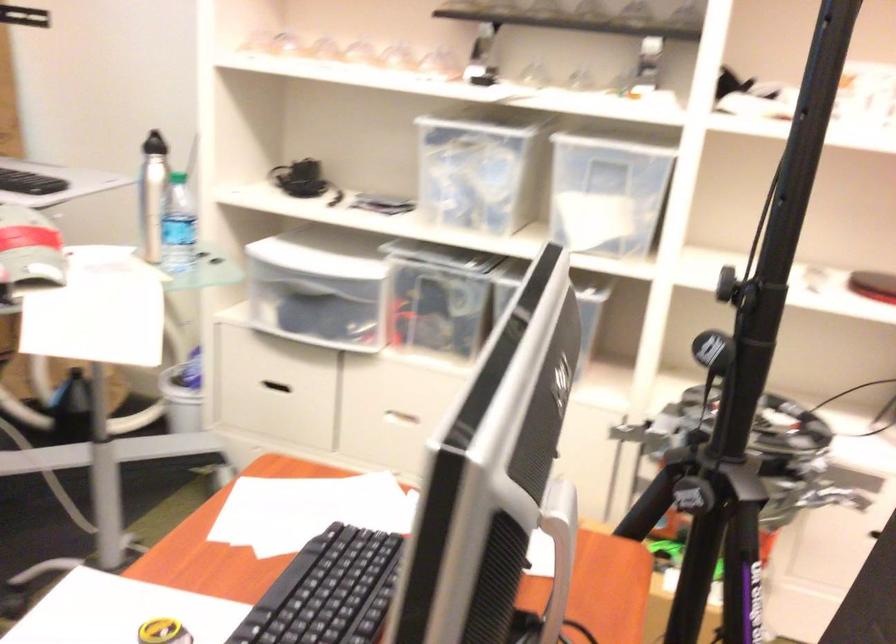
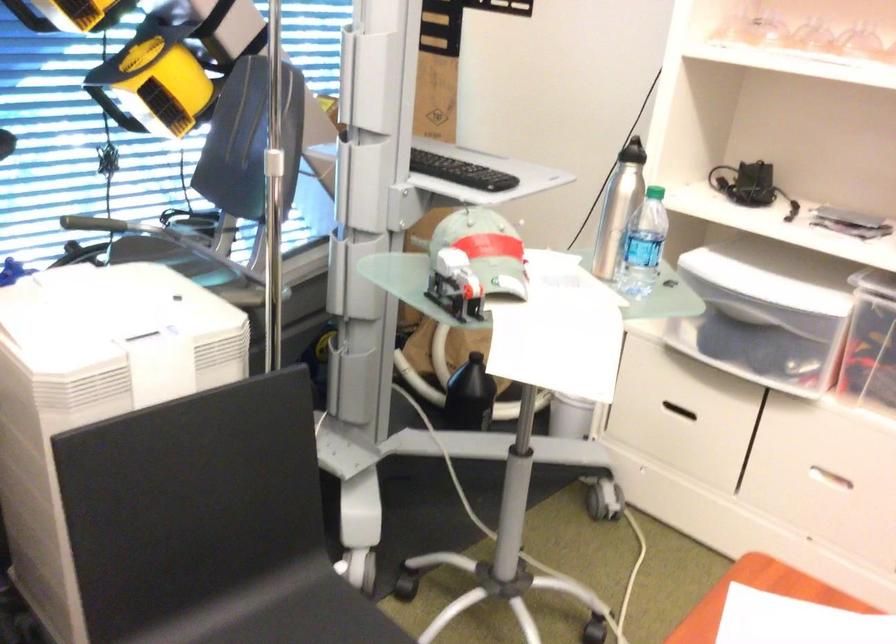
Question: The first image is from the beginning of the video and the second image is from the end. How did the camera likely rotate when shooting the video?

Choices:
 (A) Left
 (B) Right
 (C) Up
 (D) Down

Answer: (A)